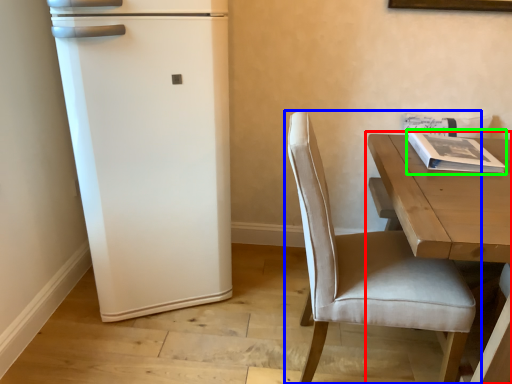
Question: Estimate the real-world distances between objects in this image. Which object is closer to table (highlighted by a red box), chair (highlighted by a blue box) or magazine (highlighted by a green box)?

Choices:
 (A) chair
 (B) magazine

Answer: (B)